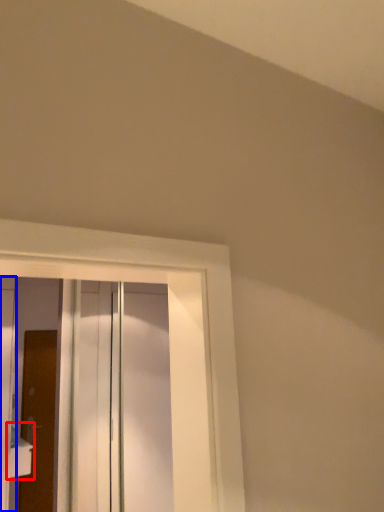
Question: Among these objects, which one is nearest to the camera, sink (highlighted by a red box) or door (highlighted by a blue box)?

Choices:
 (A) sink
 (B) door

Answer: (B)